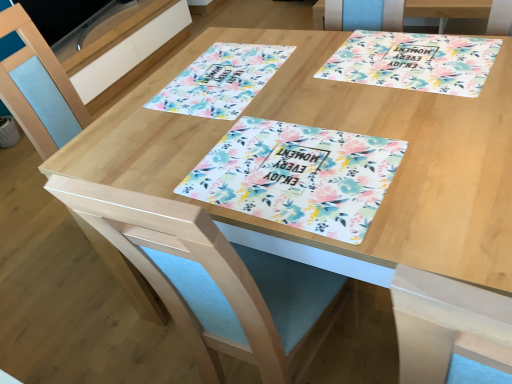
Identify the location of vacant area situated to the left side of floral paper placemat at upper center, acting as the second flyer starting from the front. The width and height of the screenshot is (512, 384). (132, 111).